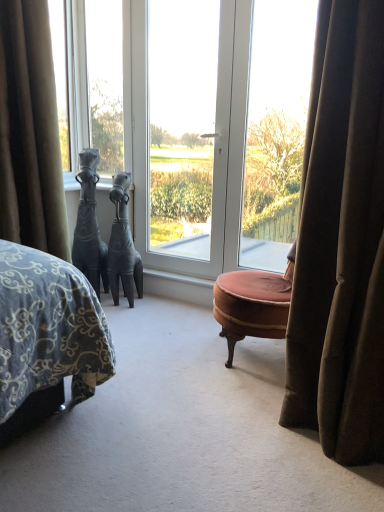
Question: Is black matte horse at left, acting as the second sculpture starting from the right, bigger than velvet brown ottoman at center?

Choices:
 (A) no
 (B) yes

Answer: (A)

Question: Is velvet brown ottoman at center a part of black matte horse at left, acting as the second sculpture starting from the right?

Choices:
 (A) yes
 (B) no

Answer: (B)

Question: Considering the relative sizes of black matte horse at left, acting as the second sculpture starting from the right, and velvet brown ottoman at center in the image provided, is black matte horse at left, acting as the second sculpture starting from the right, thinner than velvet brown ottoman at center?

Choices:
 (A) no
 (B) yes

Answer: (B)

Question: Can you confirm if black matte horse at left, the 1th sculpture from the left, is smaller than velvet brown ottoman at center?

Choices:
 (A) no
 (B) yes

Answer: (B)

Question: Is black matte horse at left, the 1th sculpture from the left, to the left of velvet brown ottoman at center from the viewer's perspective?

Choices:
 (A) no
 (B) yes

Answer: (B)

Question: From the image's perspective, is transparent glass screen door at center located above or below clear glass window at center, positioned as the 3th window in left-to-right order?

Choices:
 (A) below
 (B) above

Answer: (B)

Question: Is transparent glass screen door at center in front of or behind clear glass window at center, the first window viewed from the right, in the image?

Choices:
 (A) behind
 (B) front

Answer: (A)

Question: Is transparent glass screen door at center inside or outside of clear glass window at center, the first window viewed from the right?

Choices:
 (A) inside
 (B) outside

Answer: (B)

Question: Visually, is transparent glass screen door at center positioned to the left or to the right of clear glass window at center, positioned as the 3th window in left-to-right order?

Choices:
 (A) right
 (B) left

Answer: (B)

Question: Considering the positions of point (264, 159) and point (205, 162), is point (264, 159) closer or farther from the camera than point (205, 162)?

Choices:
 (A) farther
 (B) closer

Answer: (B)

Question: From a real-world perspective, is white glossy door at center, the 2th window viewed from the left, above or below transparent glass screen door at center?

Choices:
 (A) below
 (B) above

Answer: (A)

Question: Relative to transparent glass screen door at center, is white glossy door at center, which ranks as the 2th window in right-to-left order, in front or behind?

Choices:
 (A) front
 (B) behind

Answer: (A)

Question: Looking at their shapes, would you say white glossy door at center, which ranks as the 2th window in right-to-left order, is wider or thinner than transparent glass screen door at center?

Choices:
 (A) wide
 (B) thin

Answer: (B)

Question: Is point (167, 144) closer or farther from the camera than point (114, 241)?

Choices:
 (A) closer
 (B) farther

Answer: (B)

Question: Considering the positions of transparent glass screen door at center and matte black sculpture at center, placed as the 1th sculpture when sorted from right to left, in the image, is transparent glass screen door at center bigger or smaller than matte black sculpture at center, placed as the 1th sculpture when sorted from right to left,?

Choices:
 (A) small
 (B) big

Answer: (B)